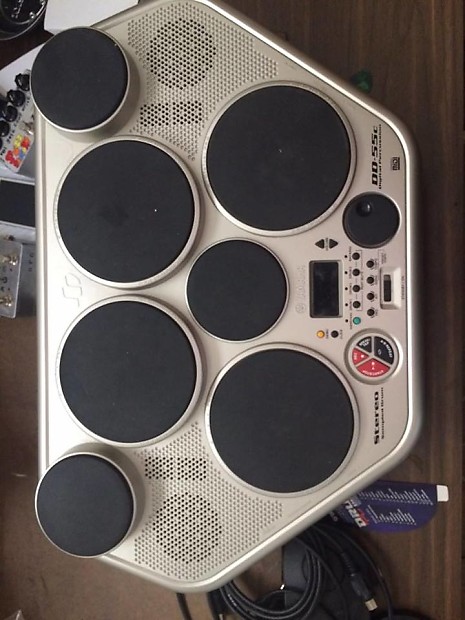
Find the location of a particular element. Image resolution: width=465 pixels, height=620 pixels. knob is located at coordinates (372, 219).